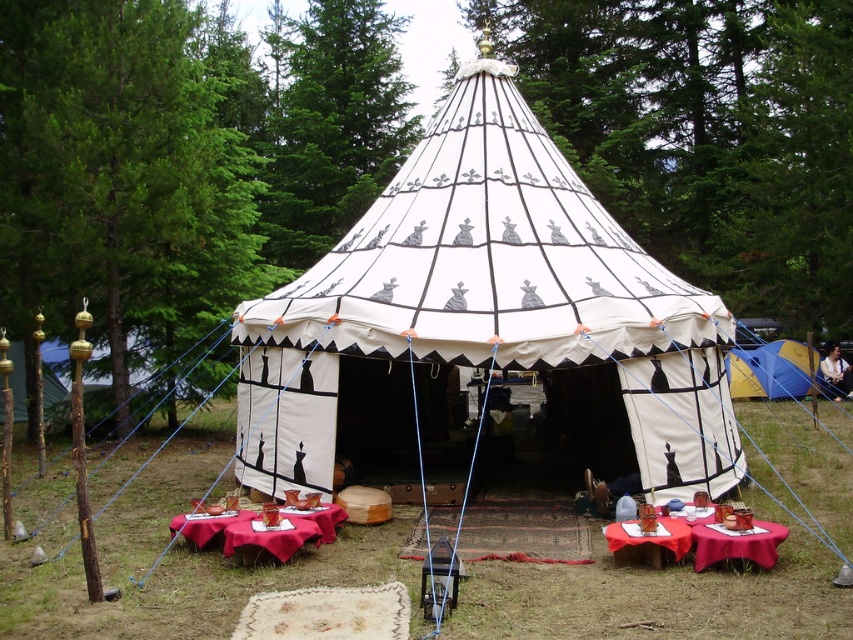
Question: Which point is closer to the camera?

Choices:
 (A) smooth red tablecloth at lower center
 (B) blue canvas tent at right
 (C) white canvas tent at center
 (D) smooth wooden table at lower center

Answer: (A)

Question: Which of the following is the farthest from the observer?

Choices:
 (A) (654, 561)
 (B) (746, 557)

Answer: (A)

Question: Is smooth red table at lower right further to camera compared to smooth wooden table at lower center?

Choices:
 (A) yes
 (B) no

Answer: (B)

Question: Does smooth red tablecloth at lower center have a larger size compared to blue canvas tent at right?

Choices:
 (A) yes
 (B) no

Answer: (B)

Question: Is white canvas tent at center smaller than smooth red tablecloth at lower center?

Choices:
 (A) yes
 (B) no

Answer: (B)

Question: Among these objects, which one is nearest to the camera?

Choices:
 (A) smooth red cloth at lower center
 (B) smooth wooden table at lower center

Answer: (B)